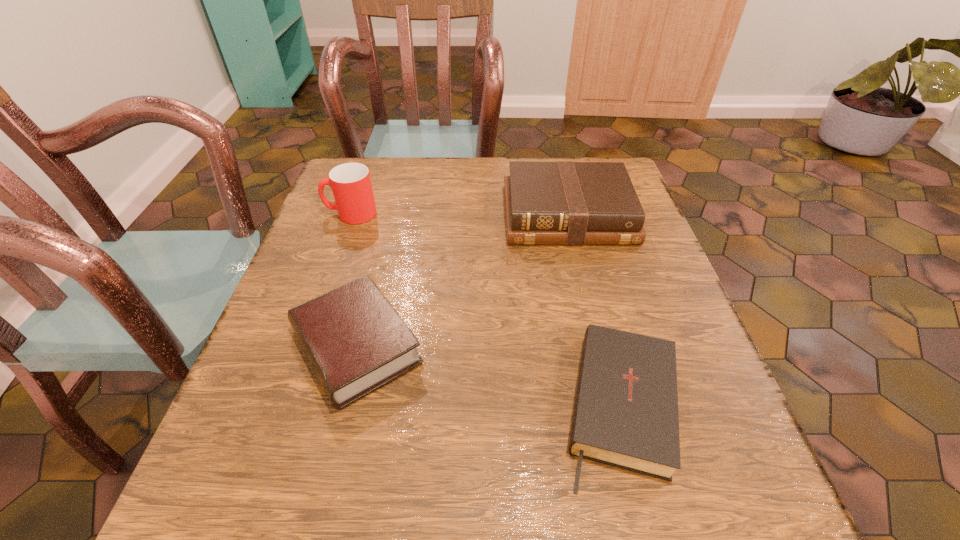
The height and width of the screenshot is (540, 960). I want to click on Bible at the far edge, so click(x=546, y=203).

You are a GUI agent. You are given a task and a screenshot of the screen. Output one action in this format:
    pyautogui.click(x=<x>, y=<y>)
    Task: Click on the object that is positioned at the near edge
    
    Given the screenshot: What is the action you would take?
    pyautogui.click(x=625, y=415)

Find the location of `cup situated at the left edge`. cup situated at the left edge is located at coordinates (350, 182).

This screenshot has height=540, width=960. Find the location of `Bible that is at the left edge`. Bible that is at the left edge is located at coordinates (356, 342).

Identify the location of object positioned at the far left corner. The height and width of the screenshot is (540, 960). (350, 182).

This screenshot has height=540, width=960. What are the coordinates of `object that is at the far right corner` in the screenshot? It's located at (546, 203).

Identify the location of object at the near right corner. The width and height of the screenshot is (960, 540). (625, 415).

You are a GUI agent. You are given a task and a screenshot of the screen. Output one action in this format:
    pyautogui.click(x=<x>, y=<y>)
    Task: Click on the free location at the far edge
    This screenshot has width=960, height=540.
    Given the screenshot: What is the action you would take?
    pyautogui.click(x=445, y=172)

Find the location of a particular element. vacant space at the near edge is located at coordinates (437, 514).

Where is `free spot at the left edge of the desktop`? The image size is (960, 540). free spot at the left edge of the desktop is located at coordinates (373, 258).